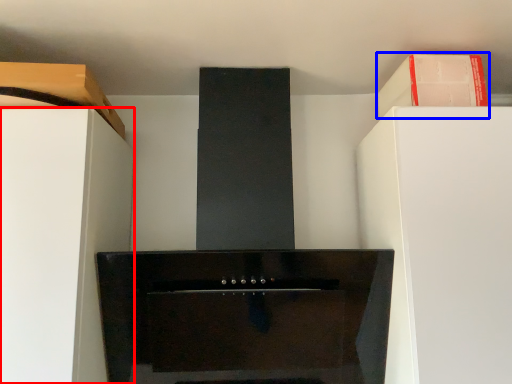
Question: Which object appears farthest to the camera in this image, furniture (highlighted by a red box) or cabinetry (highlighted by a blue box)?

Choices:
 (A) furniture
 (B) cabinetry

Answer: (B)